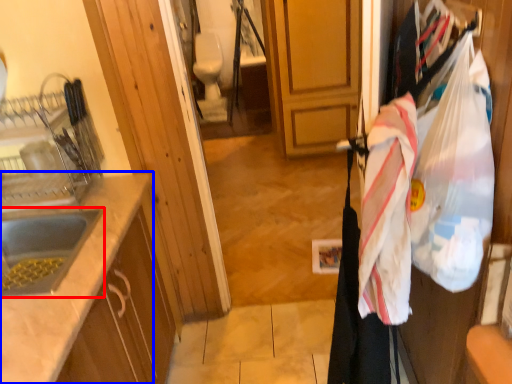
Question: Which point is closer to the camera, sink (highlighted by a red box) or countertop (highlighted by a blue box)?

Choices:
 (A) sink
 (B) countertop

Answer: (B)